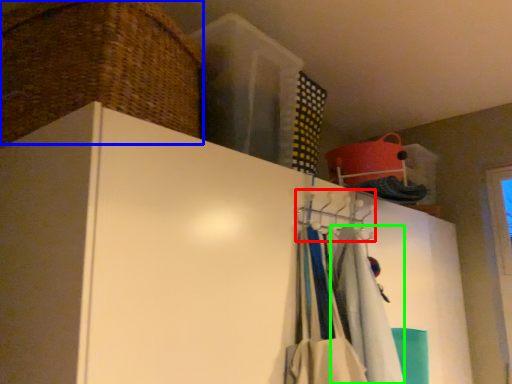
Question: Which object is positioned farthest from hanger (highlighted by a red box)? Select from basket (highlighted by a blue box) and clothing (highlighted by a green box).

Choices:
 (A) basket
 (B) clothing

Answer: (A)